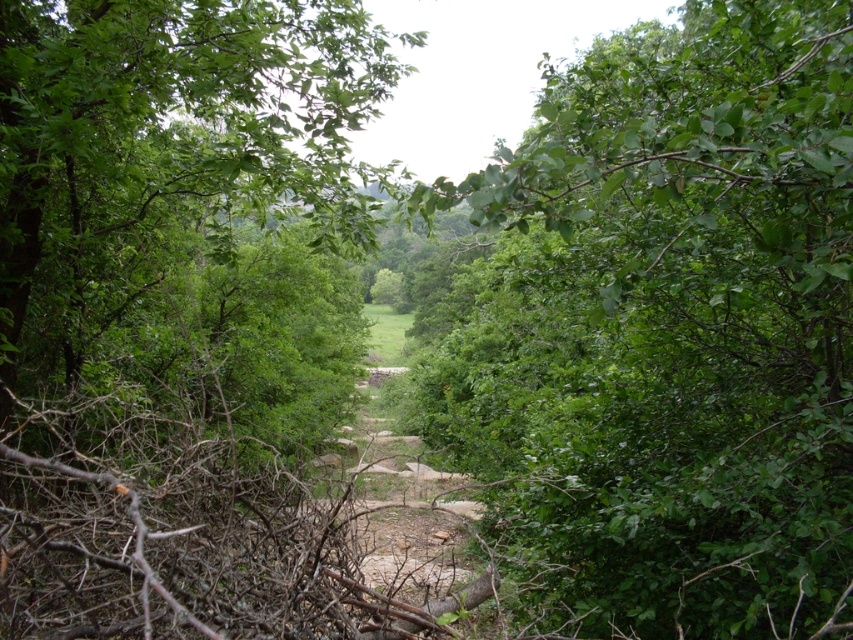
From the picture: You are a hiker who wants to take a photo of both the green leafy bush at center and the green leafy tree at center. Which one should you focus on first to ensure both are in the frame?

You should focus on the green leafy bush at center first because it is closer to you than the green leafy tree at center, so adjusting the camera to include both would require starting with the closer object.

You are a hiker trying to navigate through the forest. You see a green leafy bush at center and a green leafy tree at center along the path. Which one has a narrower width?

The green leafy bush at center is thinner than the green leafy tree at center, so the green leafy bush at center has a narrower width.

You are a hiker who wants to take a shortcut through the forest. You see a green leafy bush at center and a green leafy tree at center. Which one is closer to the ground?

The green leafy bush at center is positioned under the green leafy tree at center, so the green leafy bush at center is closer to the ground.